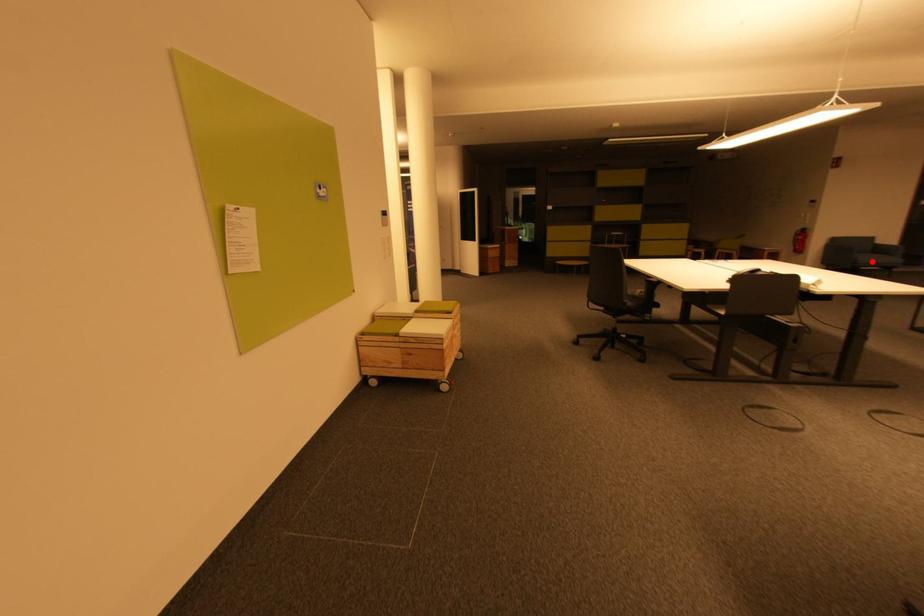
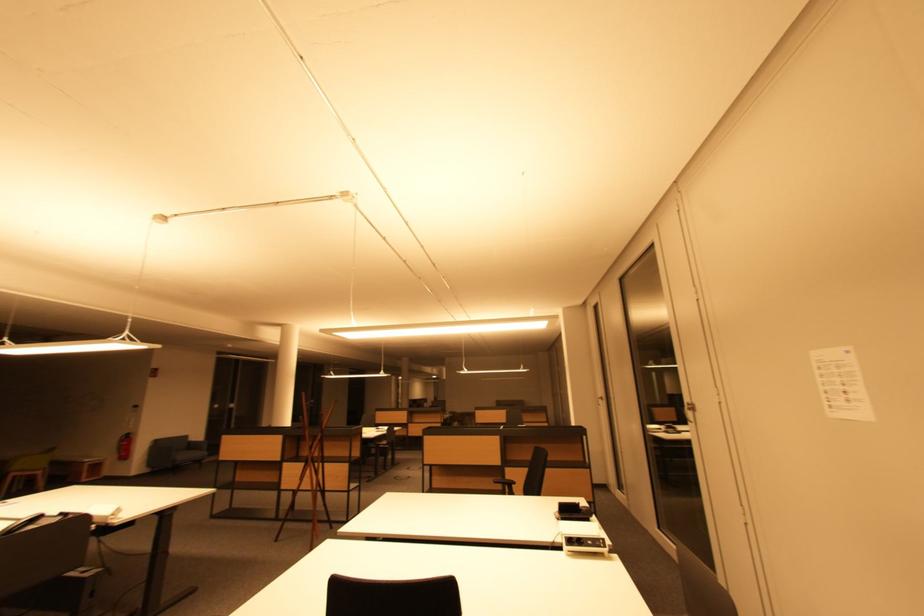
Question: I am providing you with two images of the same scene from different viewpoints. A red point is shown in image1. For the corresponding object point in image2, is it positioned nearer or farther from the camera?

Choices:
 (A) Nearer
 (B) Farther

Answer: (A)